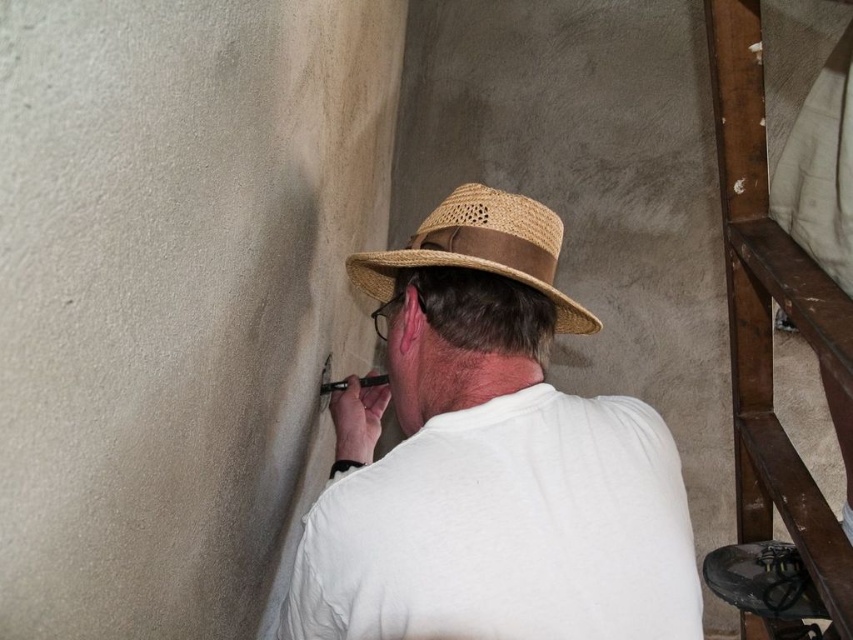
Does white matte shirt at center lie behind straw hat at center?

That is False.

Between white matte shirt at center and straw hat at center, which one is positioned higher?

straw hat at center is higher up.

Who is more forward, (474,291) or (445,230)?

Point (474,291) is in front.

The height and width of the screenshot is (640, 853). I want to click on white matte shirt at center, so click(490, 460).